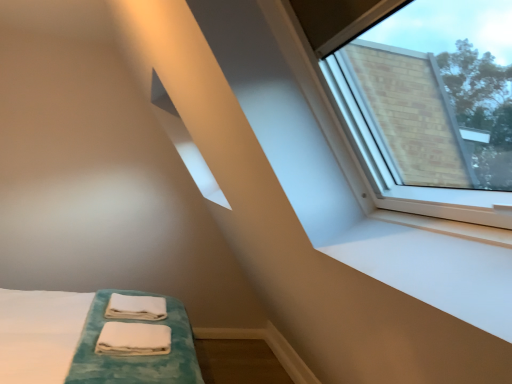
Question: Considering the positions of white soft towel at lower center and white soft towel at lower center in the image, is white soft towel at lower center wider or thinner than white soft towel at lower center?

Choices:
 (A) wide
 (B) thin

Answer: (A)

Question: Is white soft towel at lower center to the left or to the right of white soft towel at lower center in the image?

Choices:
 (A) left
 (B) right

Answer: (A)

Question: In terms of height, does white soft towel at lower center look taller or shorter compared to white soft towel at lower center?

Choices:
 (A) tall
 (B) short

Answer: (A)

Question: Looking at their shapes, would you say white soft towel at lower center is wider or thinner than white soft towel at lower center?

Choices:
 (A) wide
 (B) thin

Answer: (B)

Question: Considering the positions of white soft towel at lower center and white soft towel at lower center in the image, is white soft towel at lower center taller or shorter than white soft towel at lower center?

Choices:
 (A) short
 (B) tall

Answer: (A)

Question: Based on their sizes in the image, would you say white soft towel at lower center is bigger or smaller than white soft towel at lower center?

Choices:
 (A) small
 (B) big

Answer: (A)

Question: Is white soft towel at lower center spatially inside white soft towel at lower center, or outside of it?

Choices:
 (A) inside
 (B) outside

Answer: (B)